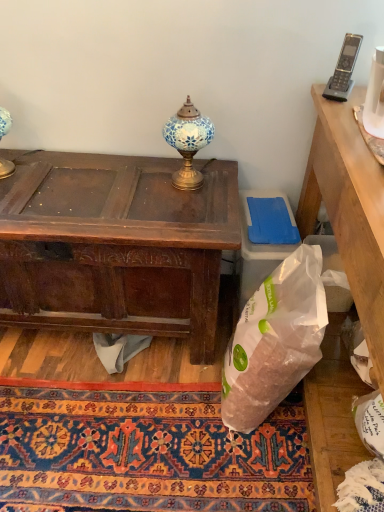
Question: Would you say white plastic trash bin/can at lower right is to the left or to the right of carpet with intricate patterns at lower center in the picture?

Choices:
 (A) left
 (B) right

Answer: (B)

Question: From a real-world perspective, relative to carpet with intricate patterns at lower center, is white plastic trash bin/can at lower right vertically above or below?

Choices:
 (A) above
 (B) below

Answer: (A)

Question: Considering the real-world distances, which object is farthest from the translucent white plastic bag at lower right?

Choices:
 (A) gray plastic phone at upper right
 (B) carpet with intricate patterns at lower center
 (C) dark brown wood desk at center
 (D) white plastic trash bin/can at lower right
 (E) blue mosaic lamp at center

Answer: (A)

Question: Considering the real-world distances, which object is farthest from the gray plastic phone at upper right?

Choices:
 (A) blue mosaic lamp at center
 (B) carpet with intricate patterns at lower center
 (C) translucent white plastic bag at lower right
 (D) dark brown wood desk at center
 (E) white plastic trash bin/can at lower right

Answer: (B)